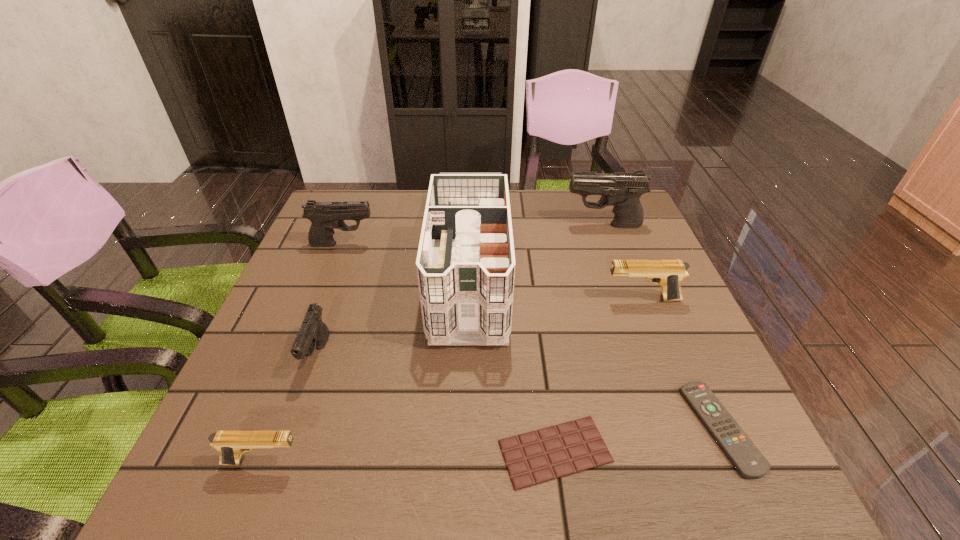
At what (x,y) coordinates should I click in order to perform the action: click on chocolate bar located at the near edge. Please return your answer as a coordinate pair (x, y). The image size is (960, 540). Looking at the image, I should click on (553, 452).

The image size is (960, 540). What are the coordinates of `remote control located in the right edge section of the desktop` in the screenshot? It's located at tap(750, 463).

I want to click on object that is at the near left corner, so click(x=231, y=444).

Identify the location of object located in the far right corner section of the desktop. The image size is (960, 540). (622, 190).

This screenshot has width=960, height=540. I want to click on object at the near right corner, so click(750, 463).

At what (x,y) coordinates should I click in order to perform the action: click on vacant space at the far edge of the desktop. Please return your answer as a coordinate pair (x, y). The image size is (960, 540). Looking at the image, I should click on (376, 220).

Image resolution: width=960 pixels, height=540 pixels. In order to click on free space at the near edge of the desktop in this screenshot , I will do `click(371, 455)`.

You are a GUI agent. You are given a task and a screenshot of the screen. Output one action in this format:
    pyautogui.click(x=<x>, y=<y>)
    Task: Click on the free location at the left edge
    This screenshot has width=960, height=540.
    Given the screenshot: What is the action you would take?
    pyautogui.click(x=347, y=298)

Where is `vacant area at the right edge of the desktop`? vacant area at the right edge of the desktop is located at coordinates (653, 333).

Find the location of a particular element. vacant space at the far left corner of the desktop is located at coordinates (346, 191).